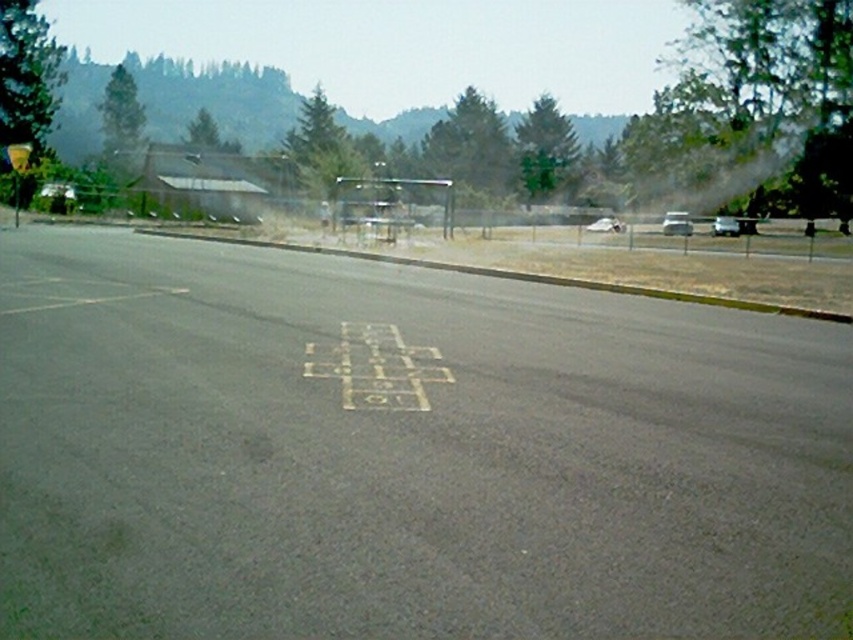
Can you confirm if silver metallic car at center is wider than white matte car at center?

Indeed, silver metallic car at center has a greater width compared to white matte car at center.

Does silver metallic car at center appear on the left side of white matte car at center?

Incorrect, silver metallic car at center is not on the left side of white matte car at center.

Identify the location of silver metallic car at center. (676, 224).

Which of these two, metallic silver car at left or white matte car at center, stands taller?

white matte car at center

Does metallic silver car at left appear on the left side of white matte car at center?

Indeed, metallic silver car at left is positioned on the left side of white matte car at center.

Does point (68, 196) come farther from viewer compared to point (607, 221)?

That is False.

Find the location of a particular element. metallic silver car at left is located at coordinates (57, 189).

Does silver metallic car at center appear under metallic silver car at left?

No, silver metallic car at center is not below metallic silver car at left.

Image resolution: width=853 pixels, height=640 pixels. What do you see at coordinates (676, 224) in the screenshot?
I see `silver metallic car at center` at bounding box center [676, 224].

Locate an element on the screen. This screenshot has height=640, width=853. silver metallic car at center is located at coordinates (676, 224).